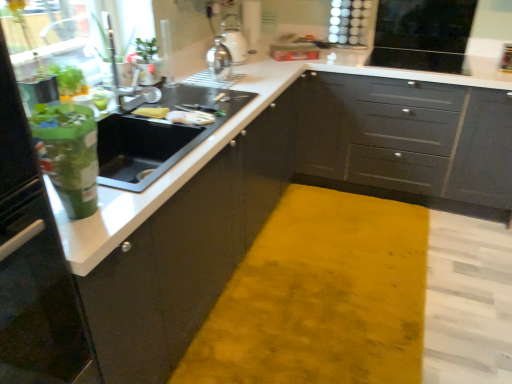
This screenshot has height=384, width=512. What do you see at coordinates (234, 39) in the screenshot?
I see `satin silver kettle at upper center, the 2th appliance from the back` at bounding box center [234, 39].

What do you see at coordinates (47, 37) in the screenshot? Image resolution: width=512 pixels, height=384 pixels. I see `transparent glass door at upper left` at bounding box center [47, 37].

The height and width of the screenshot is (384, 512). I want to click on transparent glass door at upper left, so click(x=47, y=37).

Describe the element at coordinates (190, 117) in the screenshot. I see `white glossy cutting board at upper center, marked as the 1th food in a right-to-left arrangement` at that location.

Find the location of a particular element. This screenshot has height=384, width=512. satin silver kettle at upper center, the 3th appliance when ordered from back to front is located at coordinates (219, 61).

Between matte gray cabinets at center, arranged as the 1th cabinetry when viewed from the back, and yellow sponge at sink, the second food positioned from the right, which one has less height?

yellow sponge at sink, the second food positioned from the right.

Which is in front, point (369, 114) or point (165, 114)?

The point (165, 114) is closer to the camera.

From the image's perspective, is satin silver kettle at upper center, placed as the 2th appliance when sorted from left to right, over yellow sponge at sink, the first food in the left-to-right sequence?

Correct, satin silver kettle at upper center, placed as the 2th appliance when sorted from left to right, appears higher than yellow sponge at sink, the first food in the left-to-right sequence, in the image.

From the image's perspective, starting from the satin silver kettle at upper center, placed as the 2th appliance when sorted from left to right, which food is the 1st one below? Please provide its 2D coordinates.

[(151, 112)]

Which of these two, satin silver kettle at upper center, the second appliance viewed from the right, or yellow sponge at sink, the second food positioned from the right, stands taller?

Standing taller between the two is satin silver kettle at upper center, the second appliance viewed from the right.

From a real-world perspective, which object stands above the other?

In real-world perspective, satin silver kettle at upper center, the 2th appliance from the back, is above.

From a real-world perspective, does satin silver kettle at upper center, which appears as the third appliance when viewed from the right, stand above white glossy cutting board at upper center, which is the 2th food from left to right?

Yes, from a real-world perspective, satin silver kettle at upper center, which appears as the third appliance when viewed from the right, is on top of white glossy cutting board at upper center, which is the 2th food from left to right.

From the image's perspective, between satin silver kettle at upper center, the 1th appliance when ordered from left to right, and white glossy cutting board at upper center, marked as the 1th food in a right-to-left arrangement, which one is located above?

From the image's view, satin silver kettle at upper center, the 1th appliance when ordered from left to right, is above.

Can you confirm if satin silver kettle at upper center, the 1th appliance when ordered from left to right, is bigger than white glossy cutting board at upper center, marked as the 1th food in a right-to-left arrangement?

Yes.

Considering the positions of points (221, 69) and (185, 113), is point (221, 69) closer to camera compared to point (185, 113)?

No.

Is satin silver kettle at upper center, the second appliance viewed from the right, inside the boundaries of matte black cabinets at center, which is the 1th cabinetry from front to back, or outside?

satin silver kettle at upper center, the second appliance viewed from the right, cannot be found inside matte black cabinets at center, which is the 1th cabinetry from front to back.

Based on the photo, is satin silver kettle at upper center, arranged as the 2th appliance when viewed from the front, oriented away from matte black cabinets at center, which is the 1th cabinetry from front to back?

satin silver kettle at upper center, arranged as the 2th appliance when viewed from the front, does not have its back to matte black cabinets at center, which is the 1th cabinetry from front to back.

From the image's perspective, relative to matte black cabinets at center, arranged as the 2th cabinetry when viewed from the back, is satin silver kettle at upper center, the second appliance viewed from the right, above or below?

satin silver kettle at upper center, the second appliance viewed from the right, is situated higher than matte black cabinets at center, arranged as the 2th cabinetry when viewed from the back, in the image.

Based on the photo, who is smaller, satin silver kettle at upper center, the second appliance viewed from the right, or matte black cabinets at center, arranged as the 2th cabinetry when viewed from the back?

Smaller between the two is satin silver kettle at upper center, the second appliance viewed from the right.

Does transparent glass door at upper left have a greater height compared to matte gray cabinets at center, arranged as the 1th cabinetry when viewed from the back?

No, transparent glass door at upper left is not taller than matte gray cabinets at center, arranged as the 1th cabinetry when viewed from the back.

Is transparent glass door at upper left bigger than matte gray cabinets at center, which appears as the 2th cabinetry when viewed from the front?

No, transparent glass door at upper left is not bigger than matte gray cabinets at center, which appears as the 2th cabinetry when viewed from the front.

Would you say transparent glass door at upper left is to the left or to the right of matte gray cabinets at center, arranged as the 1th cabinetry when viewed from the back, in the picture?

From the image, it's evident that transparent glass door at upper left is to the left of matte gray cabinets at center, arranged as the 1th cabinetry when viewed from the back.

Is matte gray cabinets at center, arranged as the 1th cabinetry when viewed from the back, surrounded by transparent glass door at upper left?

That's incorrect, matte gray cabinets at center, arranged as the 1th cabinetry when viewed from the back, is not inside transparent glass door at upper left.

Do you think transparent glass door at upper left is within satin silver kettle at upper center, which appears as the third appliance when viewed from the right, or outside of it?

transparent glass door at upper left cannot be found inside satin silver kettle at upper center, which appears as the third appliance when viewed from the right.

Can you confirm if transparent glass door at upper left is taller than satin silver kettle at upper center, the 3th appliance when ordered from back to front?

Yes, transparent glass door at upper left is taller than satin silver kettle at upper center, the 3th appliance when ordered from back to front.

Identify the location of glass door that appears above the satin silver kettle at upper center, which appears as the third appliance when viewed from the right (from a real-world perspective). (47, 37).

Does matte gray cabinets at center, which appears as the 2th cabinetry when viewed from the front, appear on the right side of black glossy microwave at upper right, the 3th appliance from the front?

In fact, matte gray cabinets at center, which appears as the 2th cabinetry when viewed from the front, is to the left of black glossy microwave at upper right, the 3th appliance from the front.

Is matte gray cabinets at center, which appears as the 2th cabinetry when viewed from the front, bigger than black glossy microwave at upper right, which is the 3th appliance from left to right?

Indeed, matte gray cabinets at center, which appears as the 2th cabinetry when viewed from the front, has a larger size compared to black glossy microwave at upper right, which is the 3th appliance from left to right.

From a real-world perspective, is matte gray cabinets at center, which appears as the 2th cabinetry when viewed from the front, located beneath black glossy microwave at upper right, positioned as the first appliance in right-to-left order?

Correct, in the physical world, matte gray cabinets at center, which appears as the 2th cabinetry when viewed from the front, is lower than black glossy microwave at upper right, positioned as the first appliance in right-to-left order.

From a real-world perspective, starting from the matte gray cabinets at center, which appears as the 2th cabinetry when viewed from the front, which food is the 1st one vertically above it? Please provide its 2D coordinates.

[(151, 112)]

From the satin silver kettle at upper center, the 2th appliance from the back, count the 2nd food to the left and point to it. Please provide its 2D coordinates.

[(151, 112)]

Estimate the real-world distances between objects in this image. Which object is further from yellow sponge at sink, the second food positioned from the right, satin silver kettle at upper center, which appears as the third appliance when viewed from the right, or matte gray cabinets at center, which appears as the 2th cabinetry when viewed from the front?

matte gray cabinets at center, which appears as the 2th cabinetry when viewed from the front, lies further to yellow sponge at sink, the second food positioned from the right, than the other object.

Looking at the image, which one is located further to white glossy cutting board at upper center, which is the 2th food from left to right, matte gray cabinets at center, arranged as the 1th cabinetry when viewed from the back, or yellow sponge at sink, the second food positioned from the right?

The object further to white glossy cutting board at upper center, which is the 2th food from left to right, is matte gray cabinets at center, arranged as the 1th cabinetry when viewed from the back.

From the image, which object appears to be nearer to transparent glass door at upper left, matte black cabinets at center, which is the 1th cabinetry from front to back, or satin silver kettle at upper center, the second appliance viewed from the right?

satin silver kettle at upper center, the second appliance viewed from the right, is closer to transparent glass door at upper left.

Based on their spatial positions, is satin silver kettle at upper center, the 2th appliance from the back, or transparent glass door at upper left closer to matte gray cabinets at center, arranged as the 1th cabinetry when viewed from the back?

satin silver kettle at upper center, the 2th appliance from the back, is positioned closer to the anchor matte gray cabinets at center, arranged as the 1th cabinetry when viewed from the back.

Based on their spatial positions, is satin silver kettle at upper center, which appears as the third appliance when viewed from the right, or black glossy microwave at upper right, positioned as the first appliance in right-to-left order, closer to matte gray cabinets at center, which appears as the 2th cabinetry when viewed from the front?

Among the two, black glossy microwave at upper right, positioned as the first appliance in right-to-left order, is located nearer to matte gray cabinets at center, which appears as the 2th cabinetry when viewed from the front.

Considering their positions, is transparent glass door at upper left positioned closer to matte gray cabinets at center, arranged as the 1th cabinetry when viewed from the back, than satin silver kettle at upper center, arranged as the 2th appliance when viewed from the front?

satin silver kettle at upper center, arranged as the 2th appliance when viewed from the front, lies closer to matte gray cabinets at center, arranged as the 1th cabinetry when viewed from the back, than the other object.

From the image, which object appears to be farther from black glossy microwave at upper right, which is the 3th appliance from left to right, satin silver kettle at upper center, the 1th appliance in the front-to-back sequence, or white glossy cutting board at upper center, which is the 2th food from left to right?

Based on the image, white glossy cutting board at upper center, which is the 2th food from left to right, appears to be further to black glossy microwave at upper right, which is the 3th appliance from left to right.

Looking at the image, which one is located further to yellow sponge at sink, the second food positioned from the right, matte black cabinets at center, which is the 1th cabinetry from front to back, or transparent glass door at upper left?

matte black cabinets at center, which is the 1th cabinetry from front to back, is further to yellow sponge at sink, the second food positioned from the right.

The image size is (512, 384). Find the location of `appliance positioned between yellow sponge at sink, the first food in the left-to-right sequence, and satin silver kettle at upper center, the 2th appliance from the back, from near to far`. appliance positioned between yellow sponge at sink, the first food in the left-to-right sequence, and satin silver kettle at upper center, the 2th appliance from the back, from near to far is located at coordinates (219, 61).

Find the location of `glass door between matte black cabinets at center, arranged as the 2th cabinetry when viewed from the back, and satin silver kettle at upper center, the 2th appliance from the back, in the front-back direction`. glass door between matte black cabinets at center, arranged as the 2th cabinetry when viewed from the back, and satin silver kettle at upper center, the 2th appliance from the back, in the front-back direction is located at coordinates point(47,37).

Identify the location of appliance between satin silver kettle at upper center, which appears as the third appliance when viewed from the right, and black glossy microwave at upper right, the 3th appliance from the front, from left to right. Image resolution: width=512 pixels, height=384 pixels. (234, 39).

Where is `food between transparent glass door at upper left and white glossy cutting board at upper center, marked as the 1th food in a right-to-left arrangement`? food between transparent glass door at upper left and white glossy cutting board at upper center, marked as the 1th food in a right-to-left arrangement is located at coordinates (151, 112).